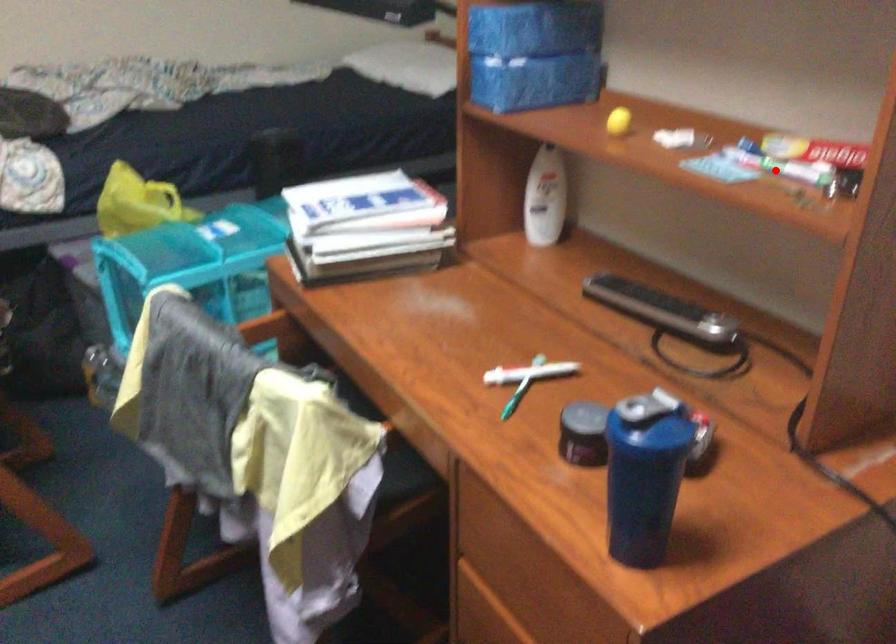
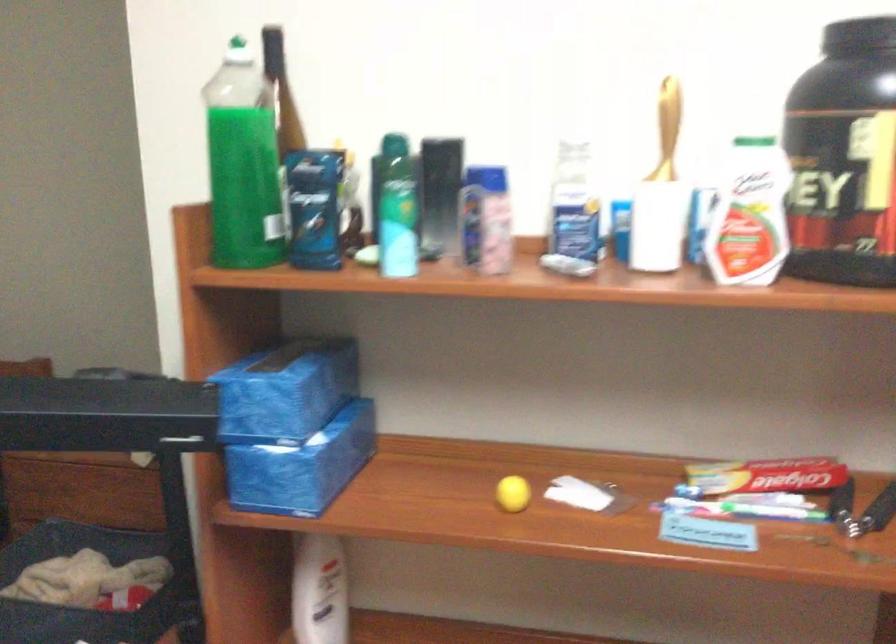
Where in the second image is the point corresponding to the highlighted location from the first image?

(743, 509)